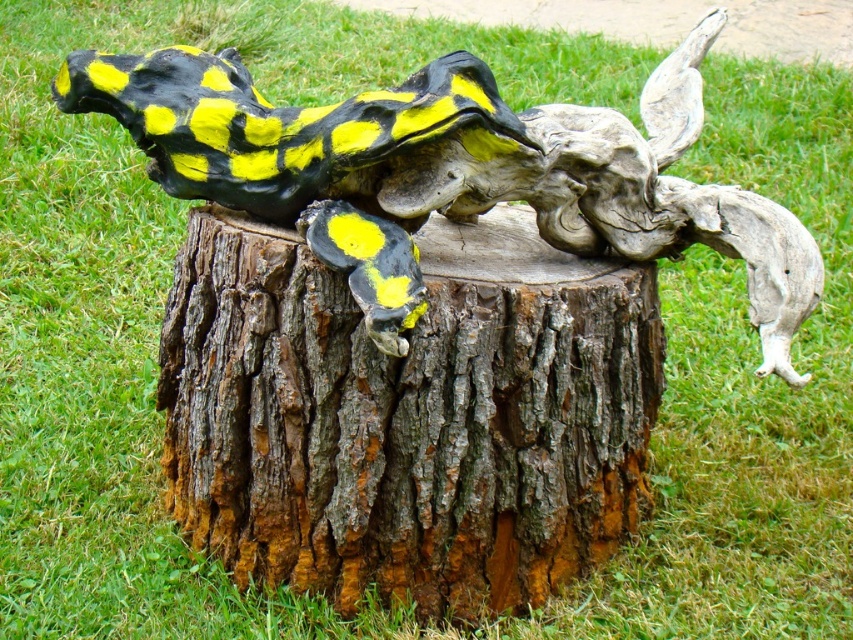
Question: Is rough bark tree stump at center wider than matte black and yellow spotted lizard at center?

Choices:
 (A) yes
 (B) no

Answer: (B)

Question: Is rough bark tree stump at center bigger than matte black and yellow spotted lizard at center?

Choices:
 (A) no
 (B) yes

Answer: (A)

Question: Is rough bark tree stump at center above matte black and yellow spotted lizard at center?

Choices:
 (A) no
 (B) yes

Answer: (A)

Question: Among these objects, which one is nearest to the camera?

Choices:
 (A) rough bark tree stump at center
 (B) matte black and yellow spotted lizard at center

Answer: (B)